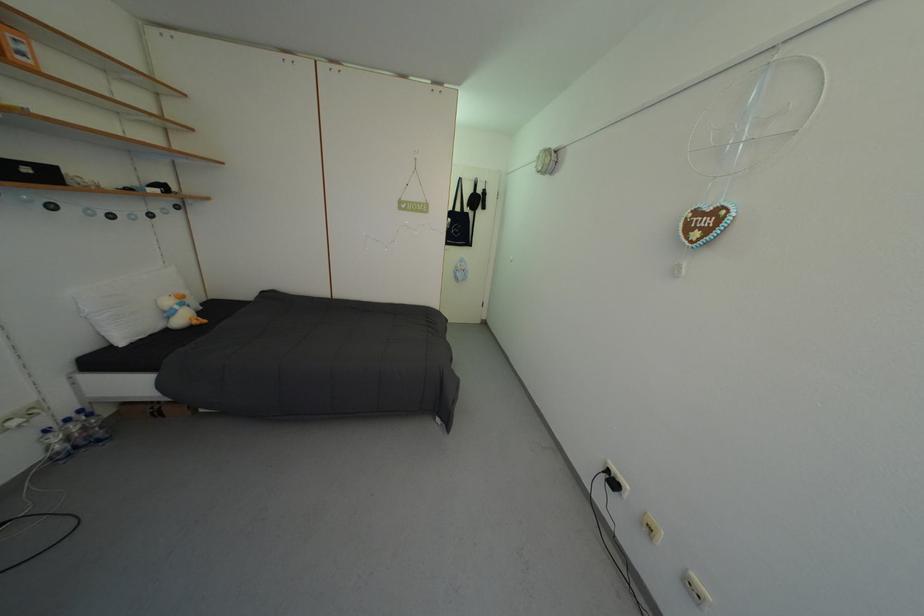
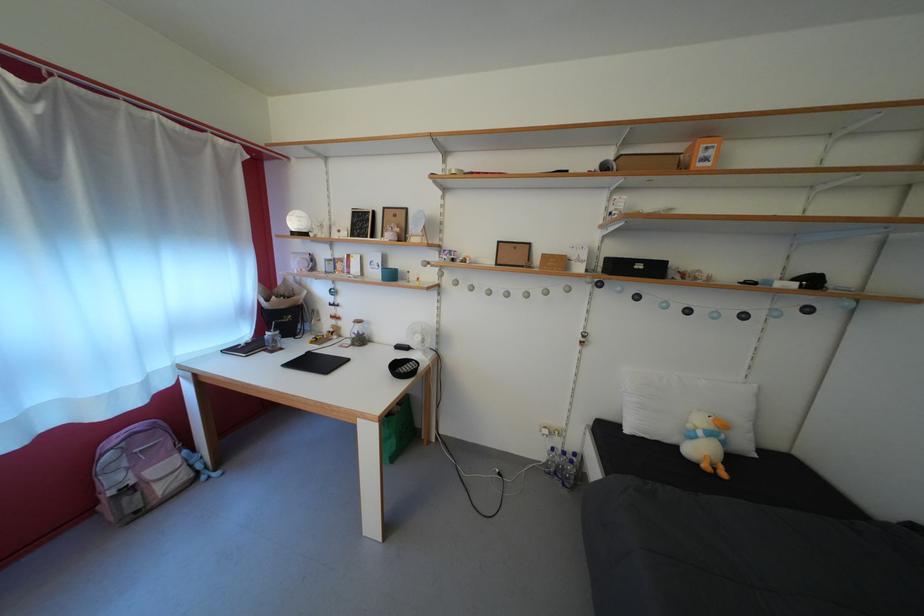
The point at (186,313) is marked in the first image. Where is the corresponding point in the second image?

(709, 439)